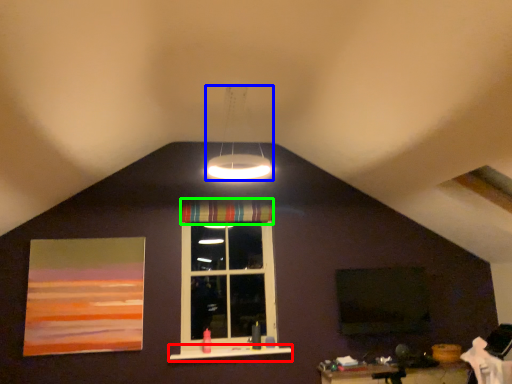
Question: Estimate the real-world distances between objects in this image. Which object is farther from window sill (highlighted by a red box), lamp (highlighted by a blue box) or curtain (highlighted by a green box)?

Choices:
 (A) lamp
 (B) curtain

Answer: (A)